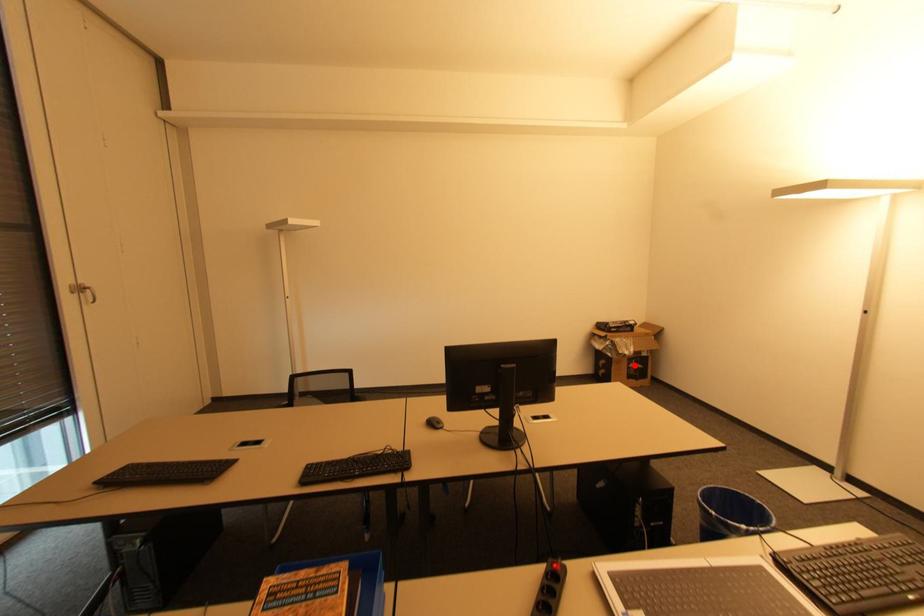
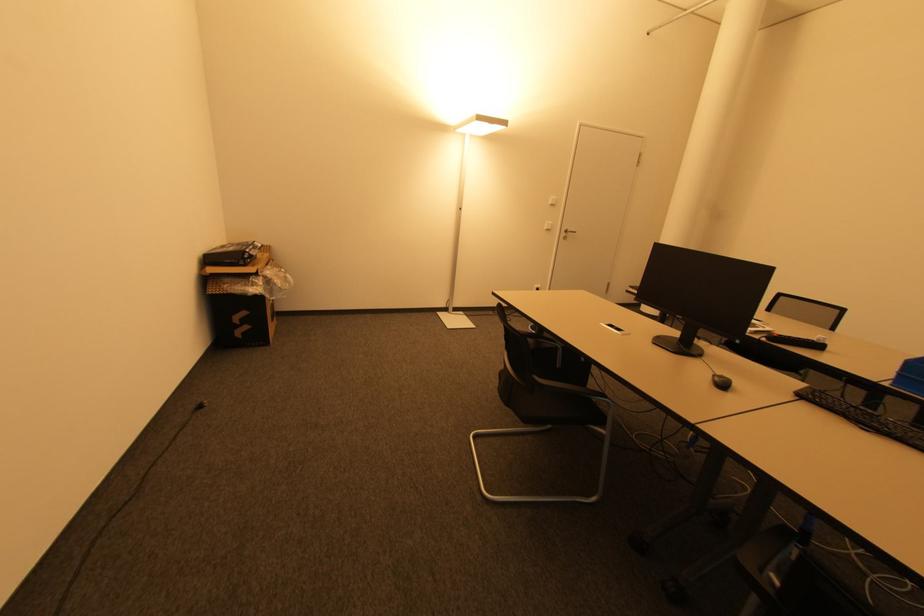
The point at the highlighted location is marked in the first image. Where is the corresponding point in the second image?

(273, 302)